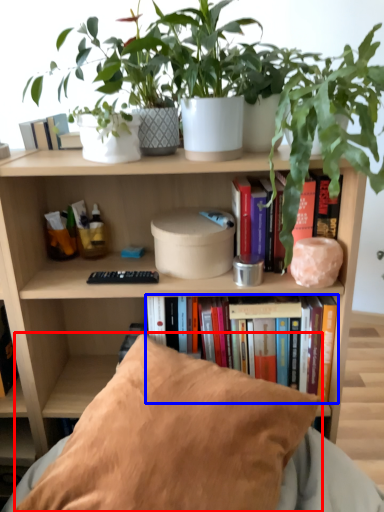
Question: Which object appears farthest to the camera in this image, pillow (highlighted by a red box) or book (highlighted by a blue box)?

Choices:
 (A) pillow
 (B) book

Answer: (B)